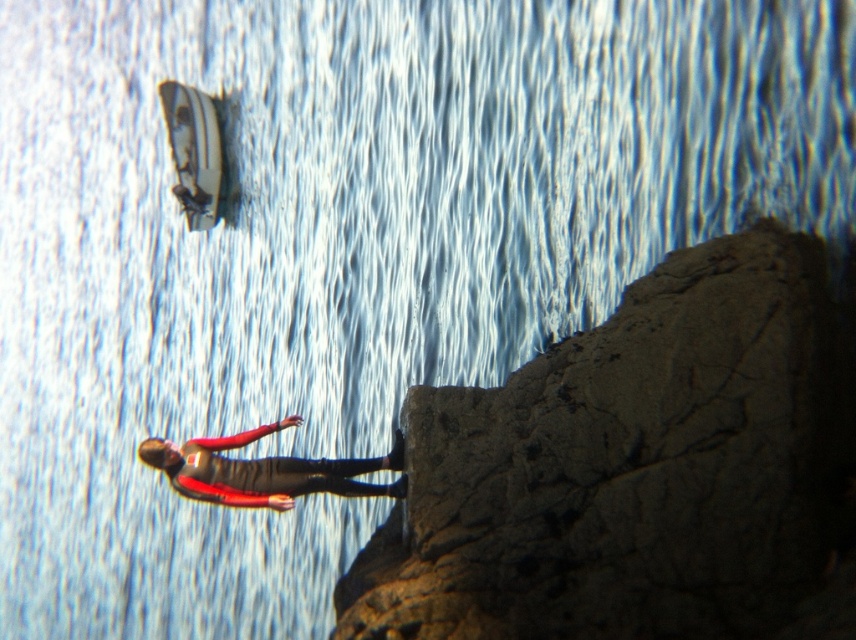
You are a photographer trying to capture the rough stone cliff at center and the red fabric jacket at center in the same frame. Based on their positions, which one should you focus on first to ensure both are in focus?

The rough stone cliff at center is in front of the red fabric jacket at center, so you should focus on the rough stone cliff at center first to ensure both are in focus.

You are a drone operator trying to capture the best aerial shot of the scene. You need to focus on both the person on the rocky outcrop and the boat in the distance. Which of the two points, point (718, 285) or point (241, 444), is closer to your drone camera lens if you are positioned directly above the scene?

Point (718, 285) is closer to the viewer than point (241, 444), so the drone camera lens would capture it first.